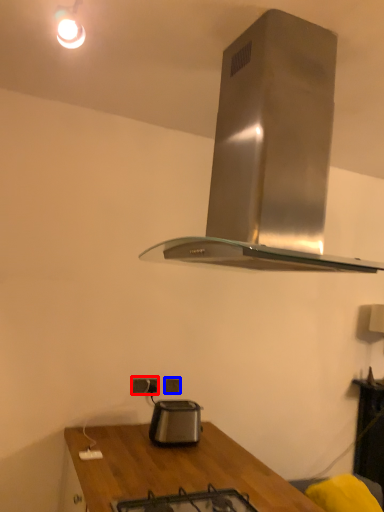
Question: Which object is closer to the camera taking this photo, electric outlet (highlighted by a red box) or electric outlet (highlighted by a blue box)?

Choices:
 (A) electric outlet
 (B) electric outlet

Answer: (A)